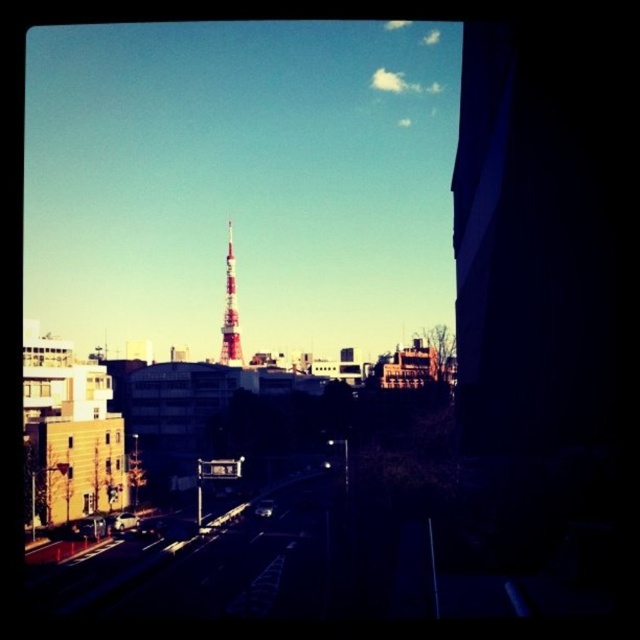
Question: From the image, what is the correct spatial relationship of smooth asphalt road at lower left in relation to red painted metal tower at center?

Choices:
 (A) right
 (B) left

Answer: (A)

Question: Which object appears closest to the camera in this image?

Choices:
 (A) red painted metal tower at center
 (B) smooth asphalt road at lower left

Answer: (B)

Question: Among these objects, which one is farthest from the camera?

Choices:
 (A) red painted metal tower at center
 (B) smooth asphalt road at lower left

Answer: (A)

Question: Is smooth asphalt road at lower left behind red painted metal tower at center?

Choices:
 (A) yes
 (B) no

Answer: (B)

Question: Which of the following is the closest to the observer?

Choices:
 (A) (102, 582)
 (B) (236, 316)

Answer: (A)

Question: Is smooth asphalt road at lower left in front of red painted metal tower at center?

Choices:
 (A) no
 (B) yes

Answer: (B)